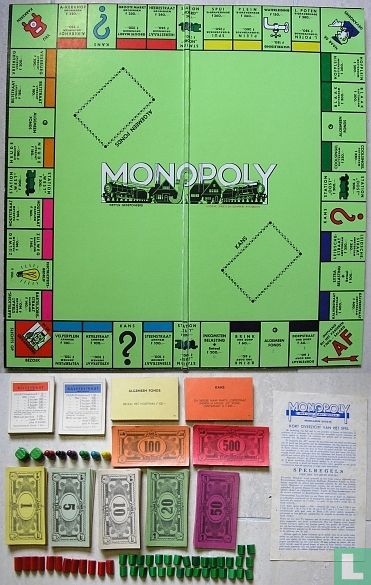
At what (x,y) coordinates should I click in order to perform the action: click on corner spaces. Please return your answer as a coordinate pair (x, y). The height and width of the screenshot is (585, 371). Looking at the image, I should click on (24, 347), (30, 24), (339, 27), (340, 333).